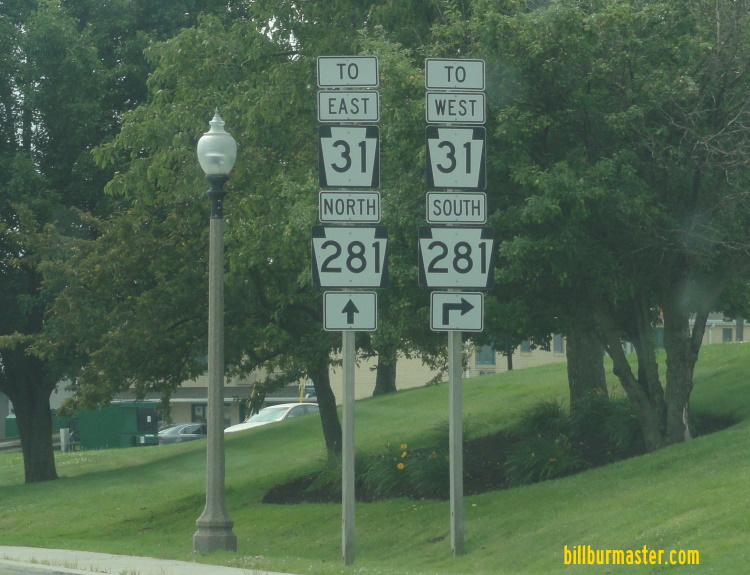
This screenshot has width=750, height=575. I want to click on light, so click(220, 158).